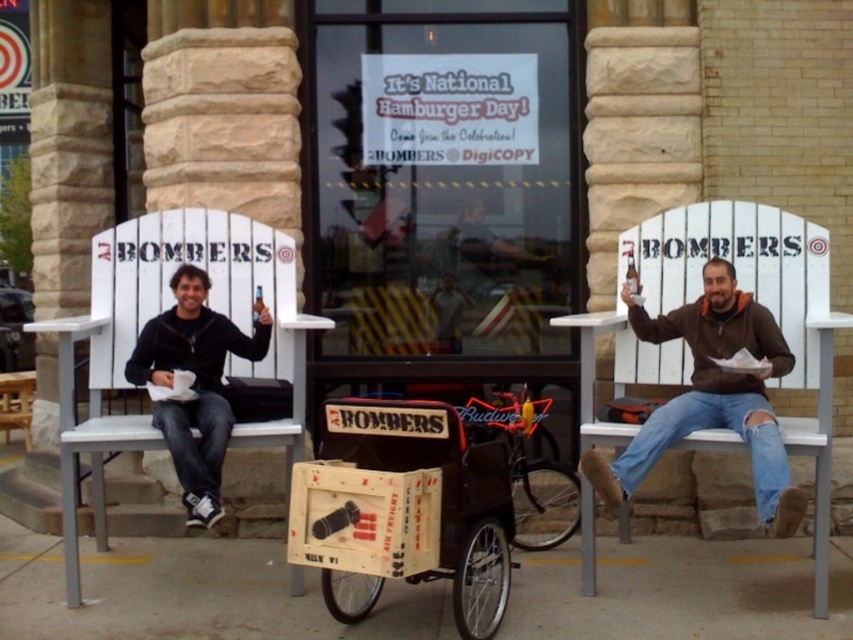
Question: Which object appears closest to the camera in this image?

Choices:
 (A) wooden crate at center
 (B) white painted wood bench at left

Answer: (A)

Question: Can you confirm if white painted wood bench at left is bigger than brown fuzzy jacket at right?

Choices:
 (A) yes
 (B) no

Answer: (A)

Question: Can you confirm if wooden crate at center is positioned to the left of neon red sign at center?

Choices:
 (A) no
 (B) yes

Answer: (B)

Question: Which of the following is the closest to the observer?

Choices:
 (A) neon red sign at center
 (B) white painted wood bench at left
 (C) brown fuzzy jacket at right
 (D) wooden crate at center

Answer: (D)

Question: Which object appears closest to the camera in this image?

Choices:
 (A) wooden crate at center
 (B) neon red sign at center

Answer: (A)

Question: Does wooden crate at center appear on the left side of neon red sign at center?

Choices:
 (A) yes
 (B) no

Answer: (A)